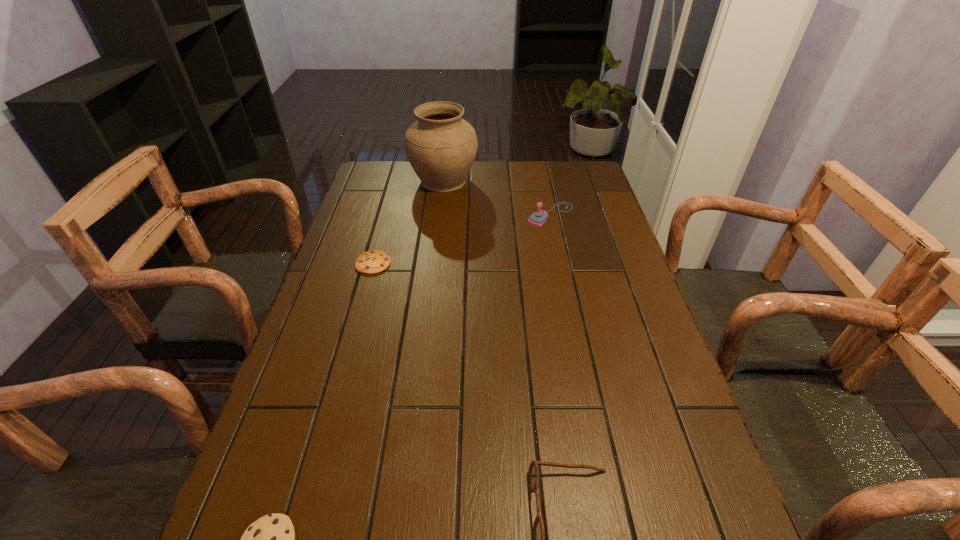
Find the location of a particular element. vacant region between the second tallest object and the farther cookie is located at coordinates (462, 239).

Select which object appears as the closest to the urn. Please provide its 2D coordinates. Your answer should be formatted as a tuple, i.e. [(x, y)], where the tuple contains the x and y coordinates of a point satisfying the conditions above.

[(538, 218)]

Identify which object is the second closest to the fourth shortest object. Please provide its 2D coordinates. Your answer should be formatted as a tuple, i.e. [(x, y)], where the tuple contains the x and y coordinates of a point satisfying the conditions above.

[(374, 261)]